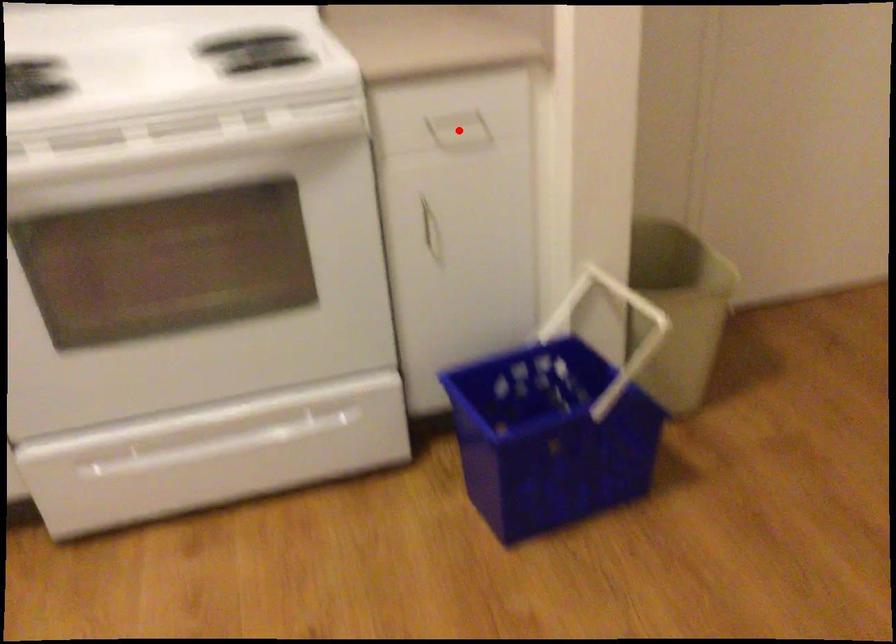
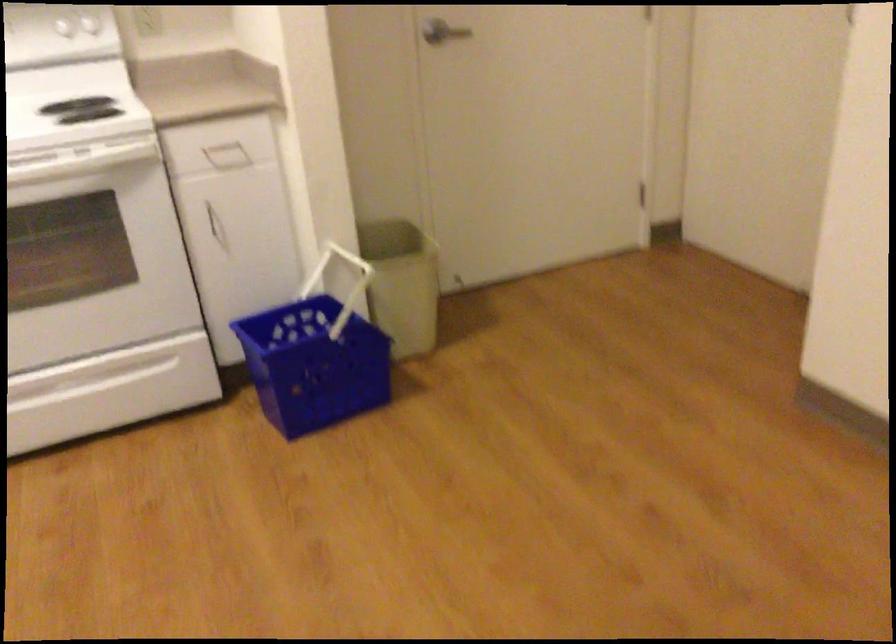
Where in the second image is the point corresponding to the highlighted location from the first image?

(227, 156)